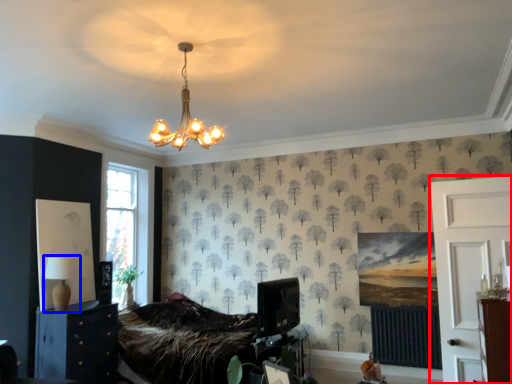
Question: Which object is closer to the camera taking this photo, side (highlighted by a red box) or table lamp (highlighted by a blue box)?

Choices:
 (A) side
 (B) table lamp

Answer: (A)